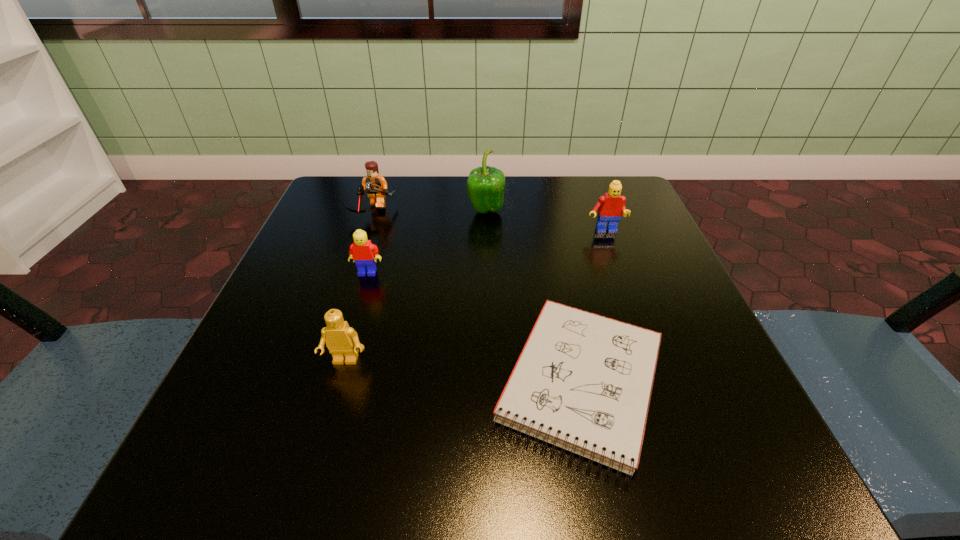
Identify the location of free spot located on the face of the nearest Lego. (314, 470).

Identify the location of free spot located on the front-facing side of the fourth farthest object. This screenshot has width=960, height=540. (353, 320).

Identify the location of free space located 0.330m on the left of the notepad. Image resolution: width=960 pixels, height=540 pixels. (261, 382).

Locate an element on the screen. The image size is (960, 540). bell pepper located in the far edge section of the desktop is located at coordinates (485, 186).

This screenshot has width=960, height=540. Identify the location of object that is at the near edge. (583, 382).

The height and width of the screenshot is (540, 960). I want to click on Lego that is at the right edge, so click(x=610, y=206).

Identify the location of notepad that is at the right edge. This screenshot has width=960, height=540. pos(583,382).

Where is `object that is at the far left corner`? The width and height of the screenshot is (960, 540). object that is at the far left corner is located at coordinates (376, 186).

Identify the location of object situated at the far right corner. click(610, 206).

The height and width of the screenshot is (540, 960). Identify the location of object positioned at the near right corner. (583, 382).